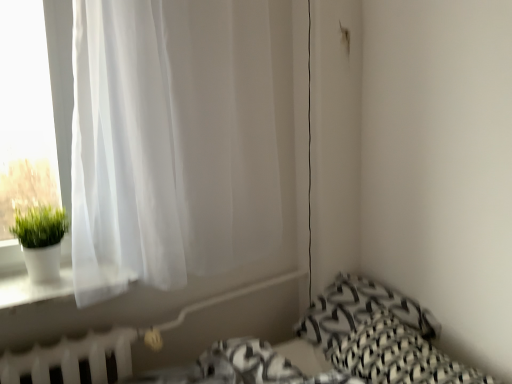
Question: Is white matte pot at left situated inside black woven pillow at lower right, the 1th pillow when ordered from front to back, or outside?

Choices:
 (A) outside
 (B) inside

Answer: (A)

Question: From a real-world perspective, is white matte pot at left above or below black woven pillow at lower right, the 1th pillow when ordered from front to back?

Choices:
 (A) below
 (B) above

Answer: (B)

Question: Estimate the real-world distances between objects in this image. Which object is farther from the white sheer curtain at left?

Choices:
 (A) black woven pillow at lower right, the 1th pillow when ordered from front to back
 (B) white matte pot at left
 (C) white plastic radiator at lower left
 (D) black woven pillow at lower right, acting as the first pillow starting from the back

Answer: (A)

Question: Which of these objects is positioned farthest from the white plastic radiator at lower left?

Choices:
 (A) white matte pot at left
 (B) black woven pillow at lower right, the 1th pillow when ordered from front to back
 (C) white sheer curtain at left
 (D) black woven pillow at lower right, acting as the first pillow starting from the back

Answer: (B)